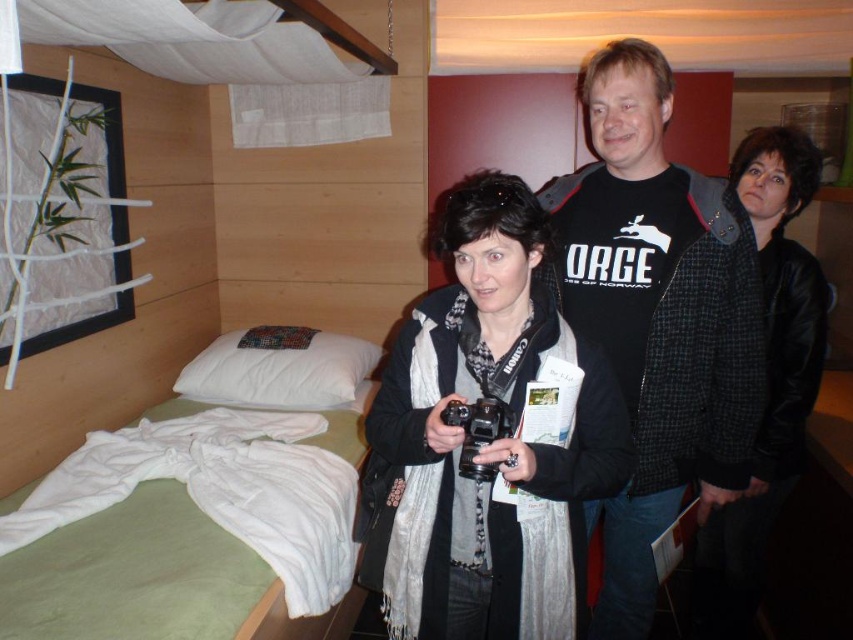
You are standing in the room and want to move from the point at coordinates point (393, 394) to the point at coordinates point (474, 413). Is the destination point in front of or behind you?

The point at coordinates point (474, 413) is in front of you because the point at coordinates point (393, 394) is behind it.